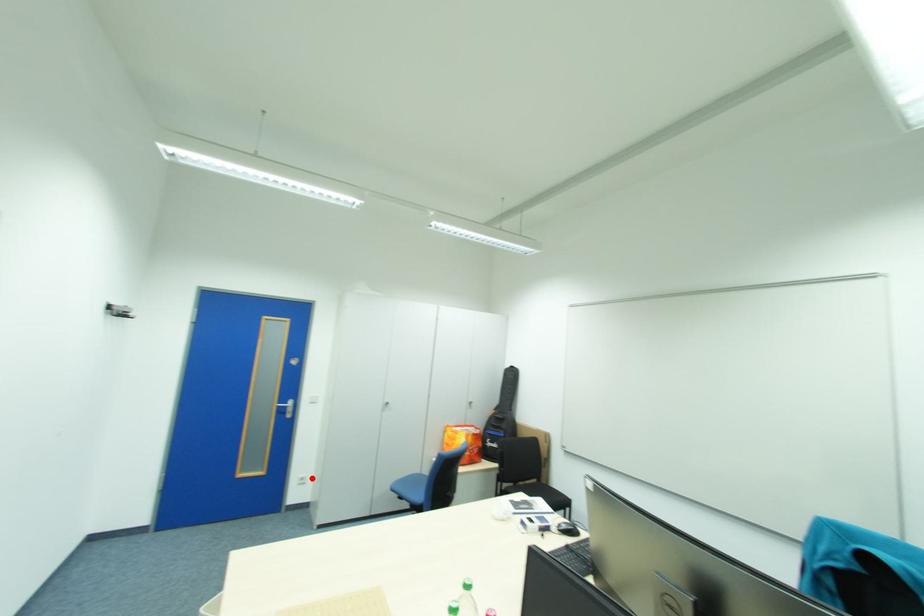
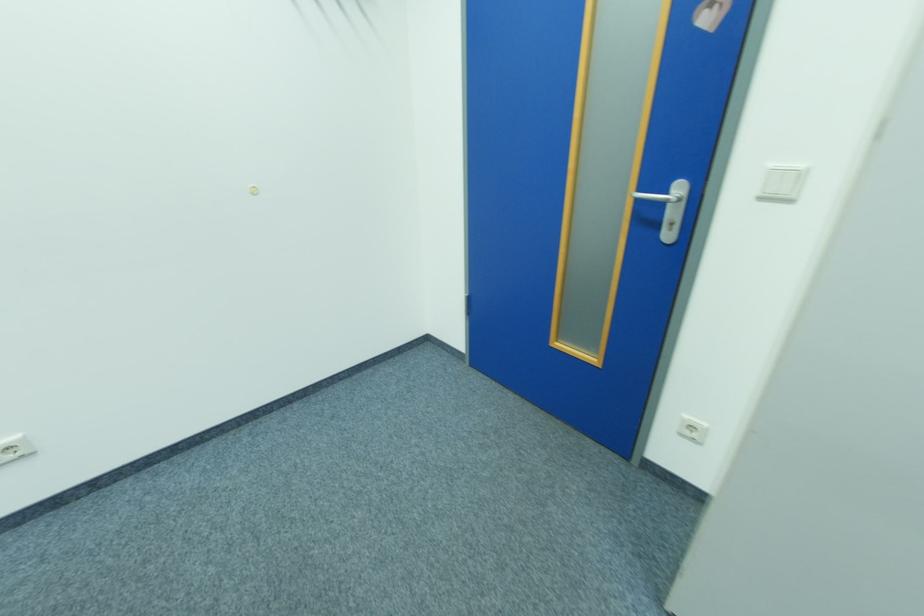
Where in the second image is the point corresponding to the highlighted location from the first image?

(702, 429)